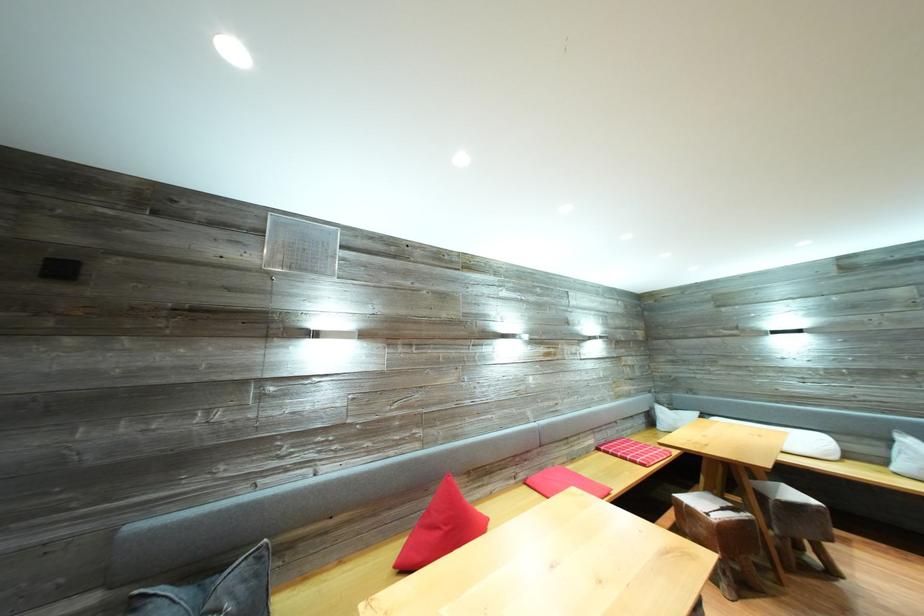
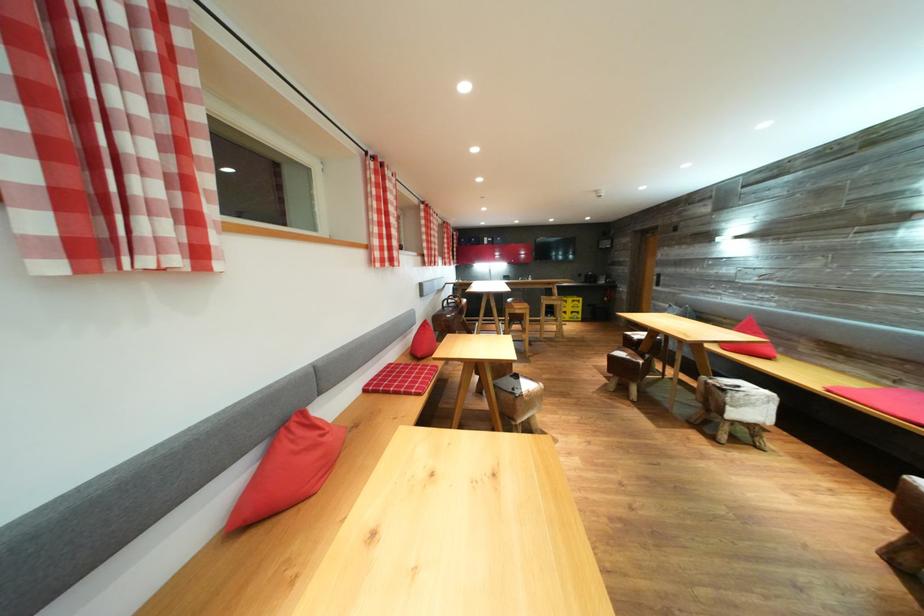
Find the pixel in the second image that matches [520,487] in the first image.

(895, 389)